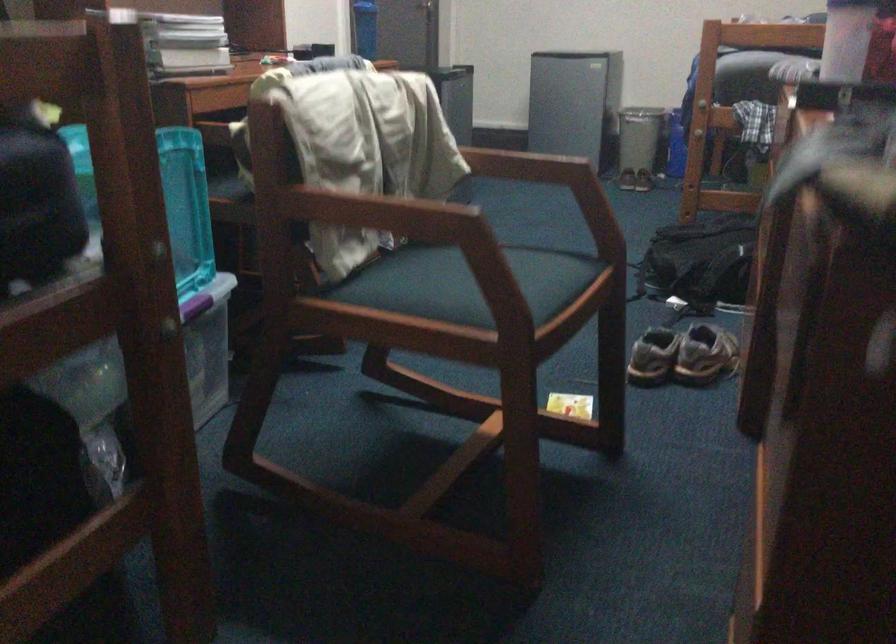
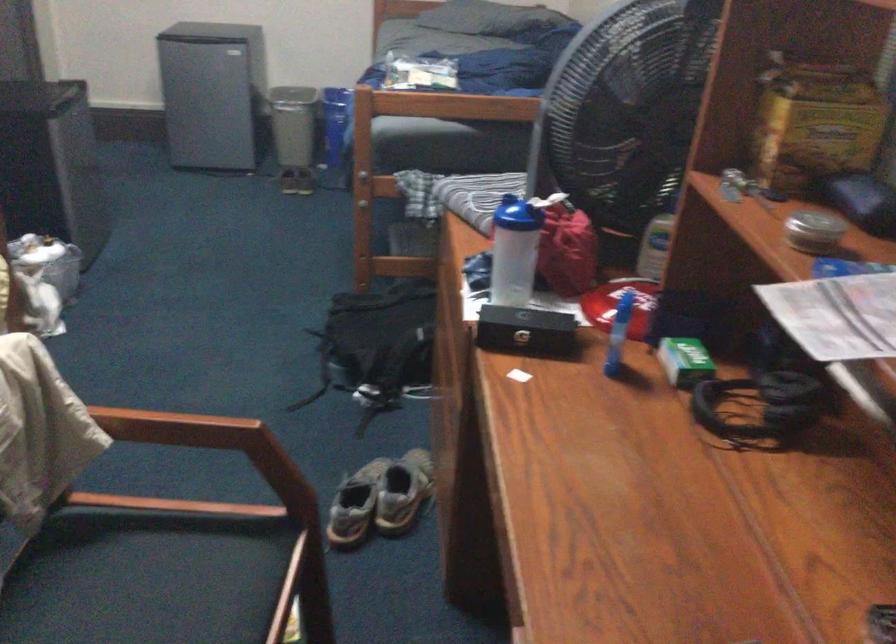
Where in the second image is the point corresponding to point (519, 162) from the first image?

(176, 428)